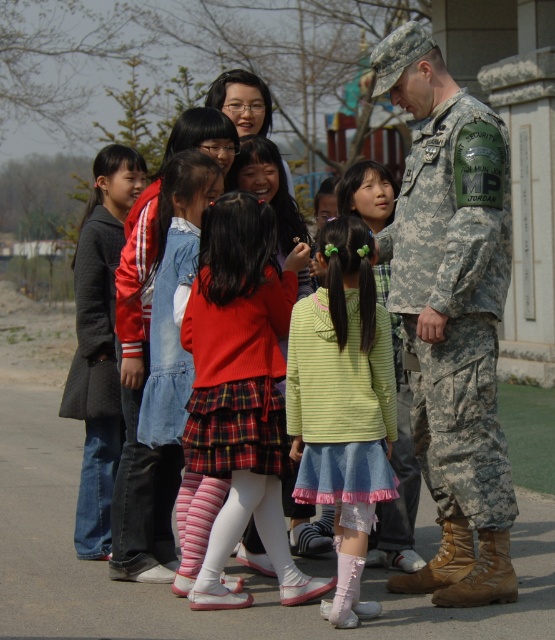
Question: Which object is farther from the camera taking this photo?

Choices:
 (A) dark gray wool coat at left
 (B) plaid skirt at center

Answer: (A)

Question: Which point appears closest to the camera in this image?

Choices:
 (A) (118, 410)
 (B) (435, 570)
 (C) (379, 358)
 (D) (219, 323)

Answer: (C)

Question: Where is camouflage uniform at right located in relation to light green denim skirt at center in the image?

Choices:
 (A) above
 (B) below

Answer: (A)

Question: Among these points, which one is farthest from the camera?

Choices:
 (A) (216, 432)
 (B) (292, 371)
 (C) (82, 282)

Answer: (C)

Question: Does light green denim skirt at center appear under dark gray wool coat at left?

Choices:
 (A) yes
 (B) no

Answer: (A)

Question: Is the position of plaid skirt at center less distant than that of light green denim skirt at center?

Choices:
 (A) yes
 (B) no

Answer: (B)